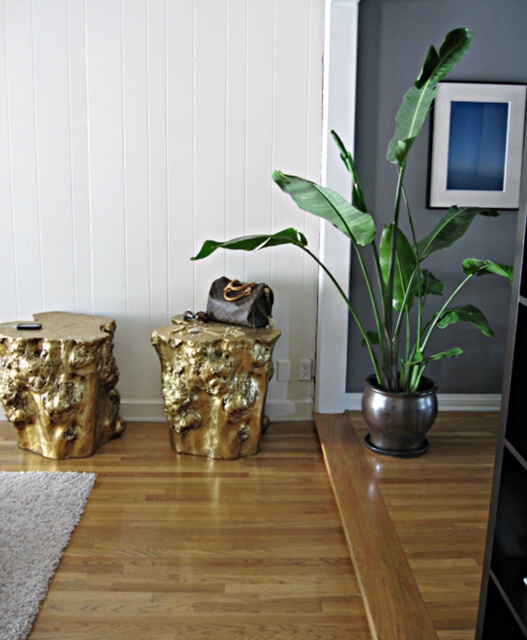
Does point (7, 394) come farther from viewer compared to point (450, 147)?

That is False.

Which is above, gold textured stump at left or metallic silver picture frame at upper right?

metallic silver picture frame at upper right

The image size is (527, 640). What do you see at coordinates (61, 384) in the screenshot?
I see `gold textured stump at left` at bounding box center [61, 384].

This screenshot has width=527, height=640. I want to click on gold textured stump at left, so click(x=61, y=384).

Does gold textured stump at left have a lesser height compared to gold textured stump at center?

In fact, gold textured stump at left may be taller than gold textured stump at center.

Does gold textured stump at left come in front of gold textured stump at center?

No, gold textured stump at left is further to the viewer.

You are a GUI agent. You are given a task and a screenshot of the screen. Output one action in this format:
    pyautogui.click(x=<x>, y=<y>)
    Task: Click on the gold textured stump at left
    This screenshot has height=640, width=527.
    Given the screenshot: What is the action you would take?
    pyautogui.click(x=61, y=384)

Based on the photo, does green leafy plant at upper right have a lesser height compared to gold textured stump at center?

Incorrect, green leafy plant at upper right's height does not fall short of gold textured stump at center's.

Is point (324, 209) positioned in front of point (188, 358)?

That is True.

Locate an element on the screen. green leafy plant at upper right is located at coordinates (392, 241).